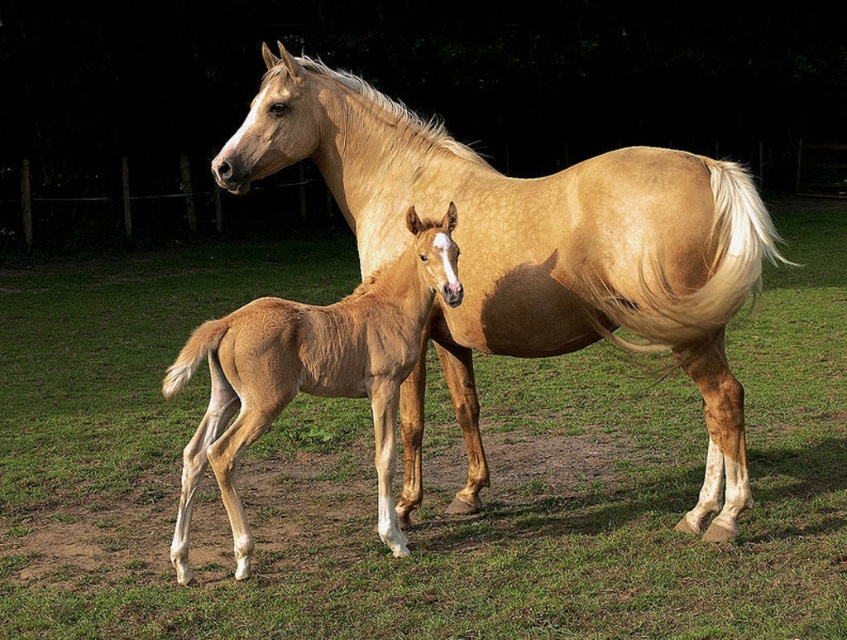
Measure the distance from light brown glossy horse at center to light brown glossy foal at center.

27.99 inches

Who is shorter, light brown glossy horse at center or light brown glossy foal at center?

light brown glossy foal at center is shorter.

You are a GUI agent. You are given a task and a screenshot of the screen. Output one action in this format:
    pyautogui.click(x=<x>, y=<y>)
    Task: Click on the light brown glossy horse at center
    
    Given the screenshot: What is the action you would take?
    pyautogui.click(x=535, y=248)

Between green grass at center and light brown glossy horse at center, which one is positioned lower?

light brown glossy horse at center is lower down.

Is point (663, 596) positioned before point (464, 513)?

Yes.

This screenshot has width=847, height=640. Identify the location of green grass at center. (424, 472).

Between green grass at center and light brown glossy foal at center, which one has more height?

green grass at center

Is green grass at center to the left of light brown glossy foal at center from the viewer's perspective?

In fact, green grass at center is to the right of light brown glossy foal at center.

In order to click on green grass at center in this screenshot , I will do `click(424, 472)`.